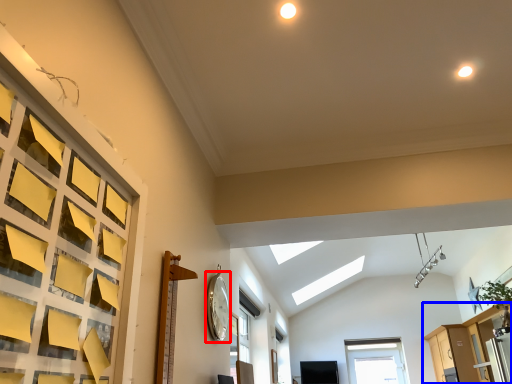
Question: Which point is further to the camera, clock (highlighted by a red box) or dresser (highlighted by a blue box)?

Choices:
 (A) clock
 (B) dresser

Answer: (B)